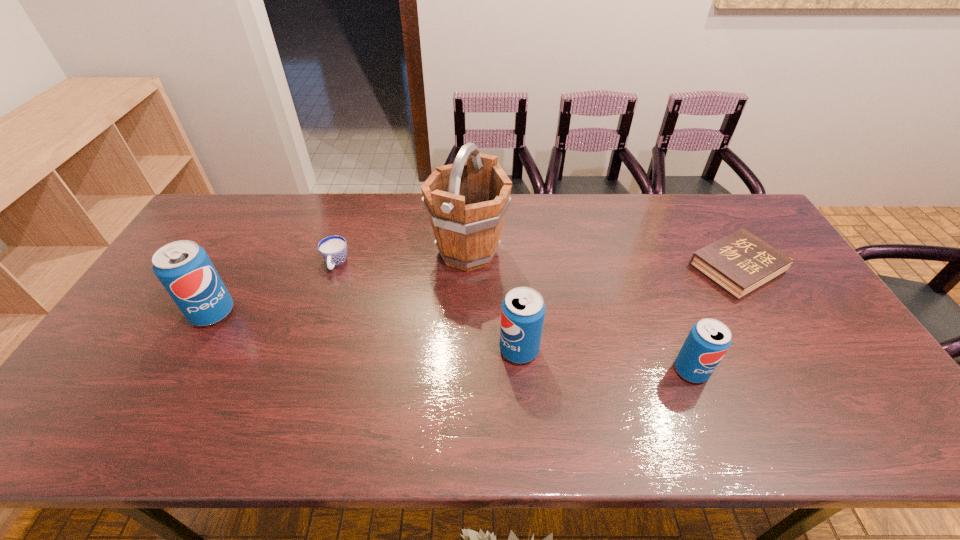
Find the location of a particular element. This screenshot has width=960, height=540. vacant region that satisfies the following two spatial constraints: 1. on the side of the second shortest object with the handle; 2. on the left side of the rightmost object is located at coordinates (334, 268).

Identify the location of vacant space that satisfies the following two spatial constraints: 1. on the back side of the bucket; 2. on the left side of the leftmost object. (247, 252).

Identify the location of free spot that satisfies the following two spatial constraints: 1. on the side of the shortest soda can with the handle; 2. on the left side of the cup. (300, 370).

This screenshot has height=540, width=960. Identify the location of vacant space that satisfies the following two spatial constraints: 1. on the side of the cup with the handle; 2. on the right side of the second soda can from right to left. (307, 350).

The height and width of the screenshot is (540, 960). I want to click on vacant area in the image that satisfies the following two spatial constraints: 1. on the side of the fifth tallest object with the handle; 2. on the left side of the fifth object from left to right, so click(300, 370).